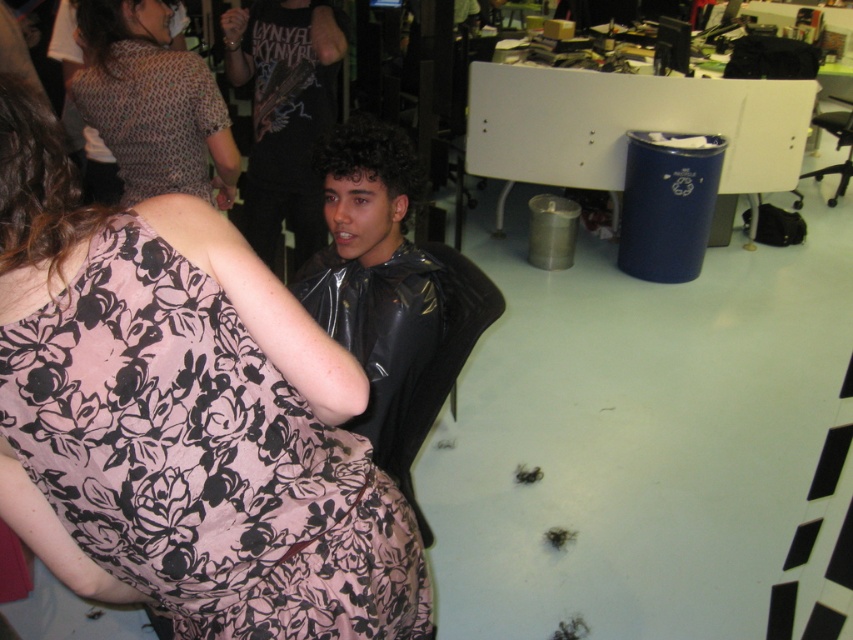
Describe the element at coordinates (152, 102) in the screenshot. I see `patterned fabric blouse at upper left` at that location.

Which is behind, point (78, 86) or point (836, 196)?

Positioned behind is point (836, 196).

Does point (132, 136) come closer to viewer compared to point (834, 202)?

Yes, it is.

Where is `patterned fabric blouse at upper left`? patterned fabric blouse at upper left is located at coordinates (x=152, y=102).

Is point (143, 132) farther from viewer compared to point (422, 378)?

Yes, it is behind point (422, 378).

Can you confirm if patterned fabric blouse at upper left is bigger than black leather chair at center?

Indeed, patterned fabric blouse at upper left has a larger size compared to black leather chair at center.

Is point (79, 24) behind point (426, 536)?

That is True.

Locate an element on the screen. patterned fabric blouse at upper left is located at coordinates (152, 102).

Between black shiny cape at center and black leather chair at center, which one has more height?

black shiny cape at center

Who is lower down, black shiny cape at center or black leather chair at center?

black leather chair at center

What are the coordinates of `black shiny cape at center` in the screenshot? It's located at (373, 268).

The image size is (853, 640). What are the coordinates of `black shiny cape at center` in the screenshot? It's located at (373, 268).